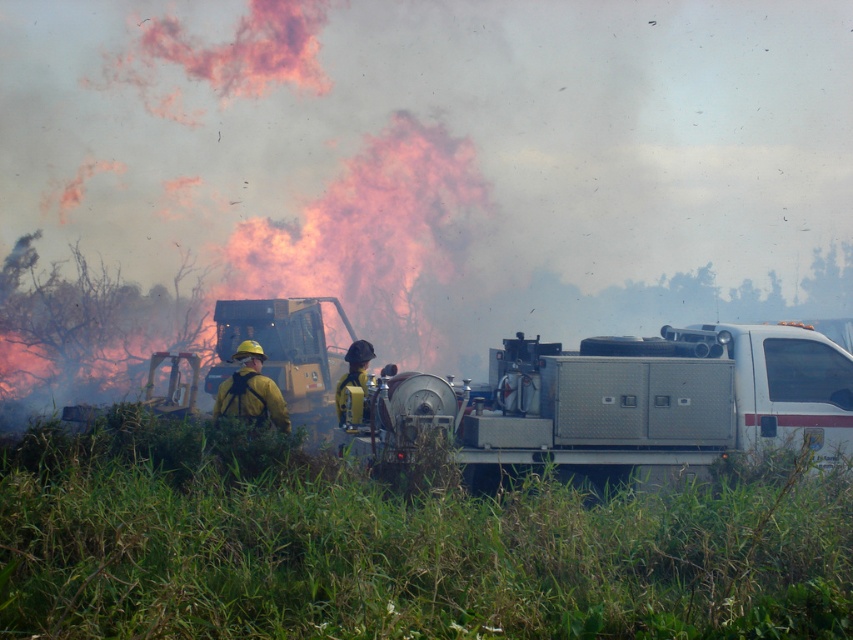
Question: Is silver metallic fire truck at center above yellow reflective vest at center?

Choices:
 (A) no
 (B) yes

Answer: (B)

Question: Which of the following is the closest to the observer?

Choices:
 (A) (337, 396)
 (B) (241, 380)

Answer: (B)

Question: Which point appears farthest from the camera in this image?

Choices:
 (A) (260, 385)
 (B) (366, 378)

Answer: (B)

Question: Observing the image, what is the correct spatial positioning of yellow matte fireman at center in reference to yellow reflective vest at center?

Choices:
 (A) left
 (B) right

Answer: (A)

Question: Can you confirm if silver metallic fire truck at center is positioned to the right of yellow reflective vest at center?

Choices:
 (A) no
 (B) yes

Answer: (B)

Question: Among these points, which one is nearest to the camera?

Choices:
 (A) (260, 352)
 (B) (581, 388)
 (C) (337, 413)

Answer: (B)